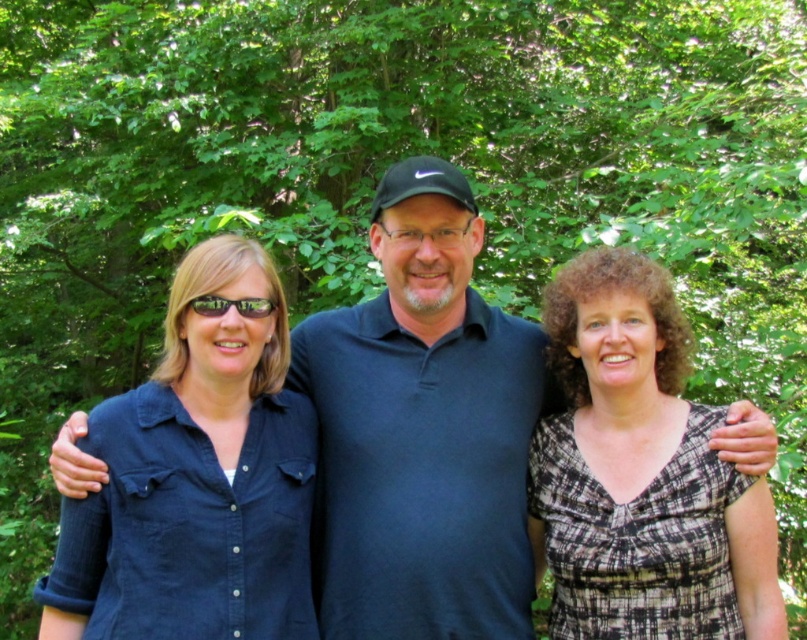
Is plaid fabric dress at center to the right of denim shirt at left from the viewer's perspective?

Indeed, plaid fabric dress at center is positioned on the right side of denim shirt at left.

This screenshot has width=807, height=640. I want to click on plaid fabric dress at center, so click(x=642, y=472).

Which is in front, point (633, 492) or point (136, 474)?

Point (136, 474)

You are a GUI agent. You are given a task and a screenshot of the screen. Output one action in this format:
    pyautogui.click(x=<x>, y=<y>)
    Task: Click on the plaid fabric dress at center
    The height and width of the screenshot is (640, 807).
    Given the screenshot: What is the action you would take?
    pyautogui.click(x=642, y=472)

Between point (283, 410) and point (257, 314), which one is positioned behind?

Positioned behind is point (283, 410).

Which is above, denim shirt at left or black reflective sunglasses at center?

black reflective sunglasses at center is higher up.

Describe the element at coordinates (208, 470) in the screenshot. I see `denim shirt at left` at that location.

At what (x,y) coordinates should I click in order to perform the action: click on denim shirt at left. Please return your answer as a coordinate pair (x, y). Looking at the image, I should click on (208, 470).

Based on the photo, who is higher up, plaid fabric dress at center or black reflective sunglasses at center?

black reflective sunglasses at center is higher up.

Is plaid fabric dress at center bigger than black reflective sunglasses at center?

Yes.

The height and width of the screenshot is (640, 807). Describe the element at coordinates (642, 472) in the screenshot. I see `plaid fabric dress at center` at that location.

The width and height of the screenshot is (807, 640). What are the coordinates of `plaid fabric dress at center` in the screenshot? It's located at (642, 472).